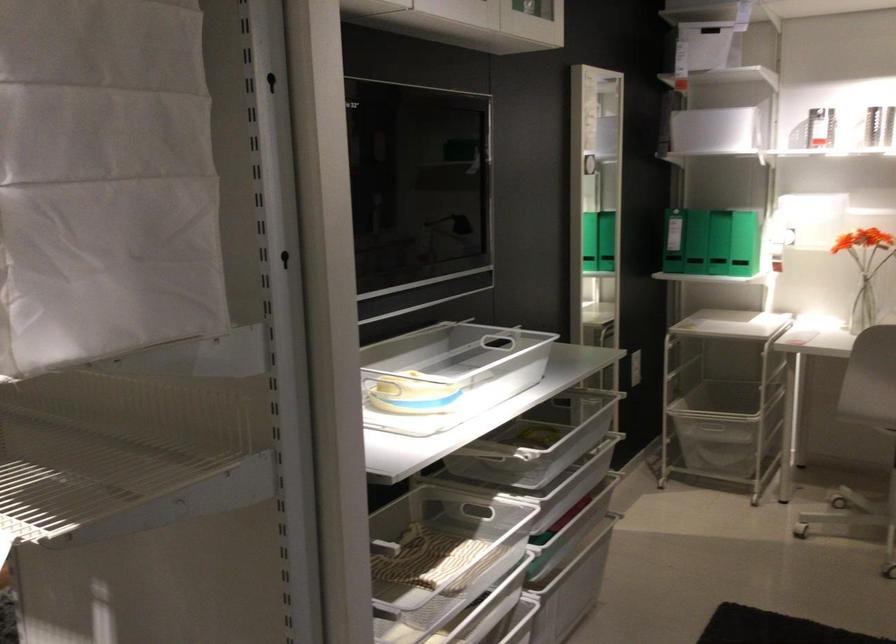
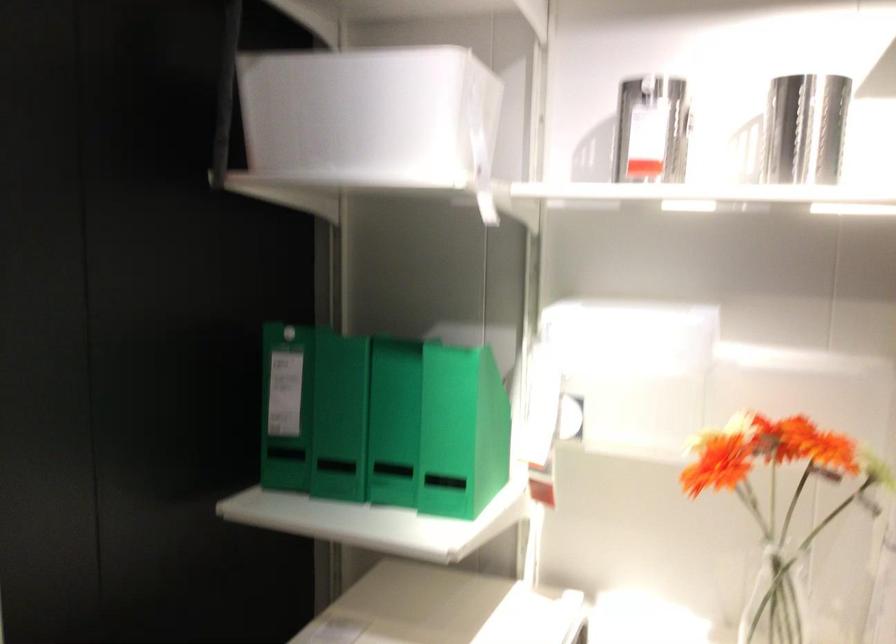
The point at [694,225] is marked in the first image. Where is the corresponding point in the second image?

(286, 406)